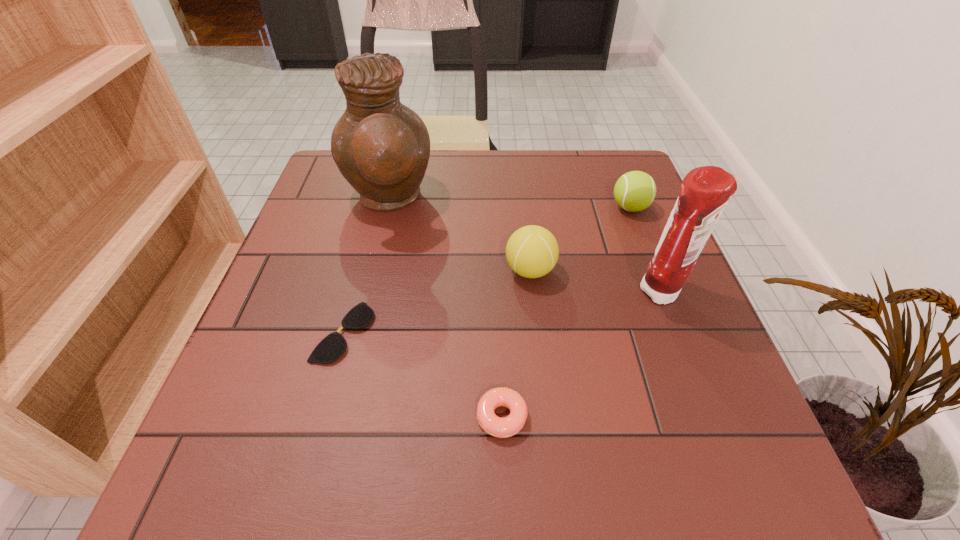
Locate an element on the screen. free space between the fifth shortest object and the shortest object is located at coordinates (503, 313).

What are the coordinates of `unoccupied area between the tallest object and the spectacles` in the screenshot? It's located at (367, 266).

I want to click on vacant space that is in between the farther tennis ball and the nearer tennis ball, so click(x=580, y=239).

What are the coordinates of `blank region between the spectacles and the right tennis ball` in the screenshot? It's located at (487, 270).

Find the location of a particular element. The width and height of the screenshot is (960, 540). free spot between the farther tennis ball and the left tennis ball is located at coordinates (580, 239).

Where is `free point between the doughnut and the pitcher`? This screenshot has width=960, height=540. free point between the doughnut and the pitcher is located at coordinates (445, 308).

This screenshot has height=540, width=960. I want to click on free area in between the nearest object and the left tennis ball, so click(x=516, y=344).

Identify the location of vacant space that is in between the condiment and the nearest object. pyautogui.click(x=582, y=355).

Choose which object is the fourth nearest neighbor to the left tennis ball. Please provide its 2D coordinates. Your answer should be formatted as a tuple, i.e. [(x, y)], where the tuple contains the x and y coordinates of a point satisfying the conditions above.

[(496, 426)]

Find the location of a particular element. The image size is (960, 540). object that is the fourth closest to the second shortest object is located at coordinates (381, 147).